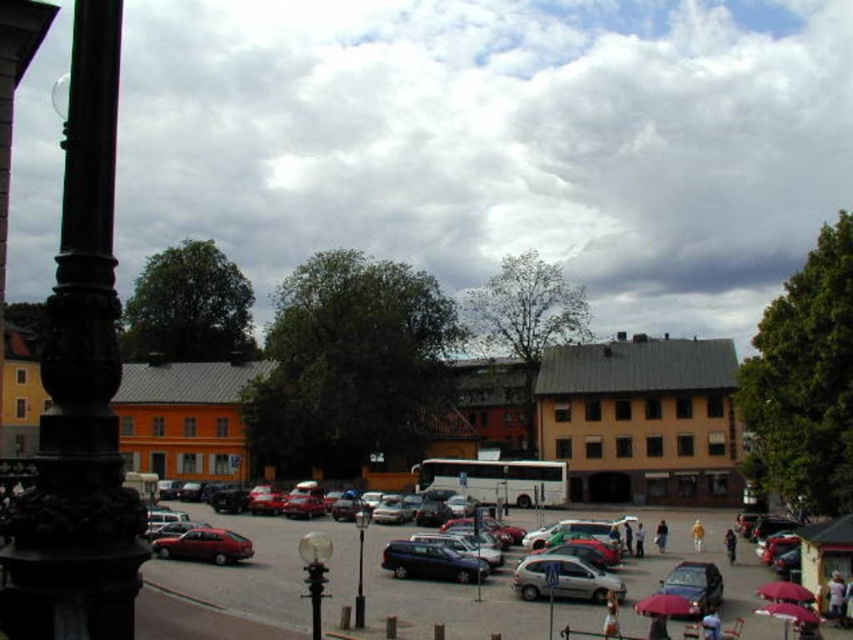
Question: Is clear glass globe at lower center above matte red umbrella at lower right?

Choices:
 (A) no
 (B) yes

Answer: (B)

Question: Is red fabric umbrella at lower right thinner than black polished lamp post at center?

Choices:
 (A) yes
 (B) no

Answer: (B)

Question: Which object appears closest to the camera in this image?

Choices:
 (A) brown leather jacket at center
 (B) matte red umbrella at lower right
 (C) black ornate pole at left
 (D) clear glass globe at lower center

Answer: (C)

Question: Which object is closer to the camera taking this photo?

Choices:
 (A) black polished lamp post at center
 (B) light brown leather jacket at center

Answer: (A)

Question: Which point is closer to the camera taking this photo?

Choices:
 (A) (776, 611)
 (B) (312, 588)

Answer: (B)

Question: Is black ornate pole at left wider than matte red umbrella at lower right?

Choices:
 (A) no
 (B) yes

Answer: (B)